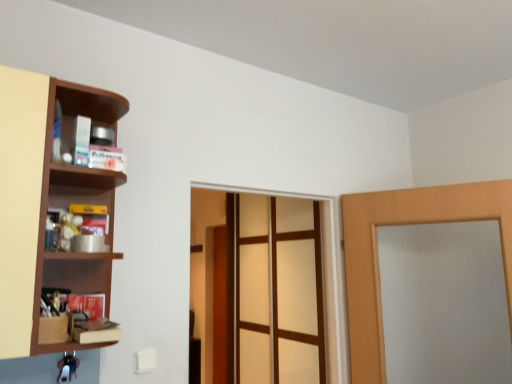
Question: Can you confirm if translucent glass screen door at center is wider than brown wooden shelf at left?

Choices:
 (A) no
 (B) yes

Answer: (A)

Question: Is translucent glass screen door at center at the left side of brown wooden shelf at left?

Choices:
 (A) yes
 (B) no

Answer: (B)

Question: Is translucent glass screen door at center bigger than brown wooden shelf at left?

Choices:
 (A) no
 (B) yes

Answer: (B)

Question: Is translucent glass screen door at center behind brown wooden shelf at left?

Choices:
 (A) yes
 (B) no

Answer: (A)

Question: Can you confirm if translucent glass screen door at center is smaller than brown wooden shelf at left?

Choices:
 (A) yes
 (B) no

Answer: (B)

Question: Looking at their shapes, would you say wooden door at center, the 1th door from the left, is wider or thinner than brown wooden shelf at left?

Choices:
 (A) thin
 (B) wide

Answer: (A)

Question: Based on their sizes in the image, would you say wooden door at center, the 2th door viewed from the right, is bigger or smaller than brown wooden shelf at left?

Choices:
 (A) big
 (B) small

Answer: (A)

Question: Is wooden door at center, arranged as the 1th door when viewed from the back, spatially inside brown wooden shelf at left, or outside of it?

Choices:
 (A) inside
 (B) outside

Answer: (B)

Question: In the image, is wooden door at center, which is counted as the 2th door, starting from the front, on the left side or the right side of brown wooden shelf at left?

Choices:
 (A) left
 (B) right

Answer: (B)

Question: Considering their positions, is wooden door at center, arranged as the 1th door when viewed from the back, located in front of or behind translucent glass screen door at center?

Choices:
 (A) behind
 (B) front

Answer: (A)

Question: Looking at the image, does wooden door at center, the 2th door viewed from the right, seem bigger or smaller compared to translucent glass screen door at center?

Choices:
 (A) small
 (B) big

Answer: (A)

Question: From the image's perspective, relative to translucent glass screen door at center, is wooden door at center, the 1th door from the left, above or below?

Choices:
 (A) above
 (B) below

Answer: (B)

Question: Is wooden door at center, arranged as the 1th door when viewed from the back, wider or thinner than translucent glass screen door at center?

Choices:
 (A) thin
 (B) wide

Answer: (B)

Question: Relative to brown wooden shelf at left, is translucent glass screen door at center in front or behind?

Choices:
 (A) behind
 (B) front

Answer: (A)

Question: Does point (248, 326) appear closer or farther from the camera than point (25, 324)?

Choices:
 (A) closer
 (B) farther

Answer: (B)